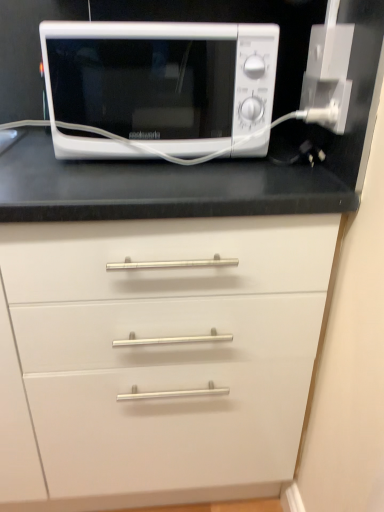
Question: From a real-world perspective, is white plastic outlet at upper right physically located above or below white matte microwave at upper center?

Choices:
 (A) above
 (B) below

Answer: (B)

Question: Is white plastic outlet at upper right in front of or behind white matte microwave at upper center in the image?

Choices:
 (A) behind
 (B) front

Answer: (A)

Question: Is white plastic outlet at upper right wider or thinner than white matte microwave at upper center?

Choices:
 (A) thin
 (B) wide

Answer: (A)

Question: Would you say white matte microwave at upper center is to the left or to the right of white plastic outlet at upper right in the picture?

Choices:
 (A) left
 (B) right

Answer: (A)

Question: In the image, is white matte microwave at upper center positioned in front of or behind white plastic outlet at upper right?

Choices:
 (A) front
 (B) behind

Answer: (A)

Question: In terms of height, does white matte microwave at upper center look taller or shorter compared to white plastic outlet at upper right?

Choices:
 (A) tall
 (B) short

Answer: (A)

Question: From the image's perspective, is white matte microwave at upper center located above or below white plastic outlet at upper right?

Choices:
 (A) above
 (B) below

Answer: (A)